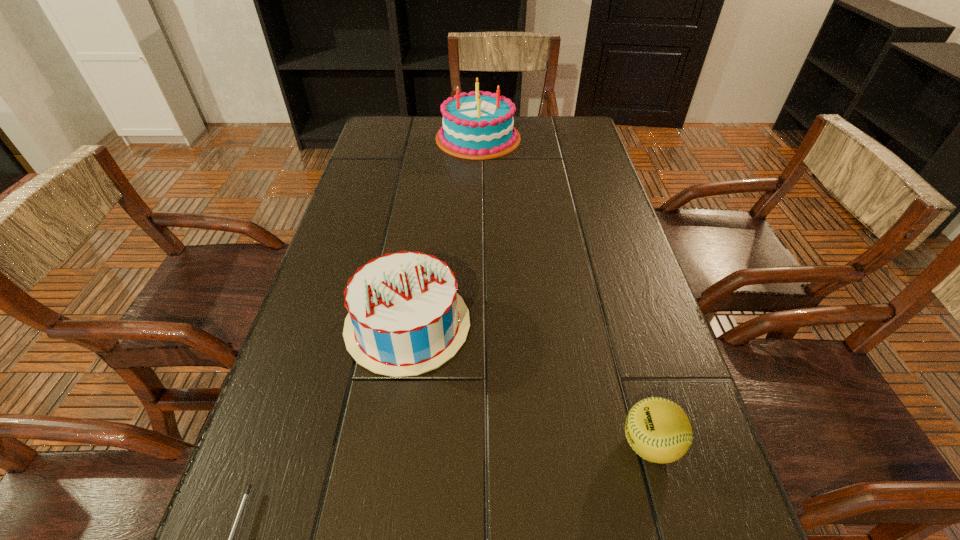
Locate an element on the screen. The image size is (960, 540). vacant region between the farther birthday cake and the third nearest object is located at coordinates (443, 232).

At what (x,y) coordinates should I click in order to perform the action: click on free space between the softball and the second farthest object. Please return your answer as a coordinate pair (x, y). This screenshot has width=960, height=540. Looking at the image, I should click on (529, 384).

This screenshot has width=960, height=540. Find the location of `unoccupied area between the nearer birthday cake and the second shortest object`. unoccupied area between the nearer birthday cake and the second shortest object is located at coordinates pyautogui.click(x=529, y=384).

Where is `the second closest object to the softball`? the second closest object to the softball is located at coordinates (240, 511).

Image resolution: width=960 pixels, height=540 pixels. I want to click on the closest object to the softball, so click(x=405, y=318).